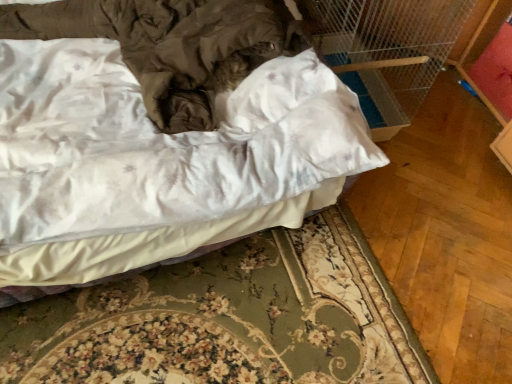
At what (x,y) coordinates should I click in order to perform the action: click on free space above white fabric bed frame at lower center (from a real-world perspective). Please return your answer as a coordinate pair (x, y). Looking at the image, I should click on (246, 324).